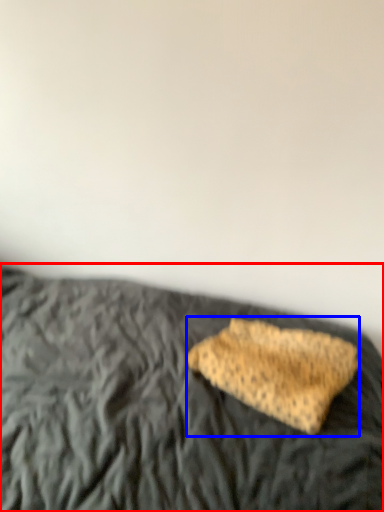
Question: Which object is further to the camera taking this photo, bed (highlighted by a red box) or sponge (highlighted by a blue box)?

Choices:
 (A) bed
 (B) sponge

Answer: (B)